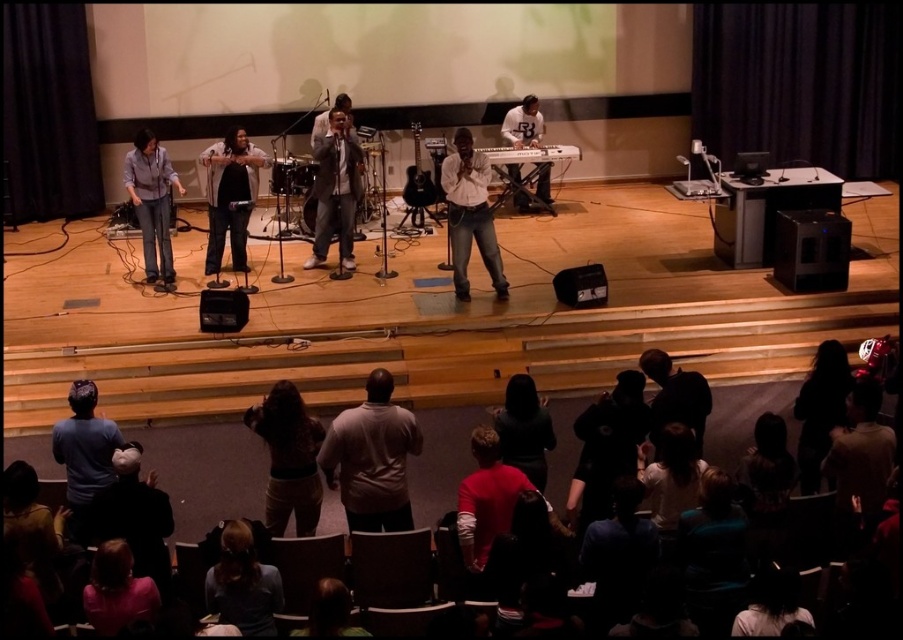
Based on the photo, you are sitting in the front row of the auditorium and want to see the white matte shirt at lower center clearly. The screen in front of you has a zoom function. What should you do?

Since the white matte shirt at lower center is 14.83 feet away from the camera, you should use the zoom function on your screen to get a closer view of it.

From the picture: You are a photographer in the audience, and you want to capture a photo of the silhouette hair at lower right and the pink fabric shirt at lower left. Based on their positions, which one is located to the right side of the other?

The silhouette hair at lower right is positioned on the right side of pink fabric shirt at lower left.